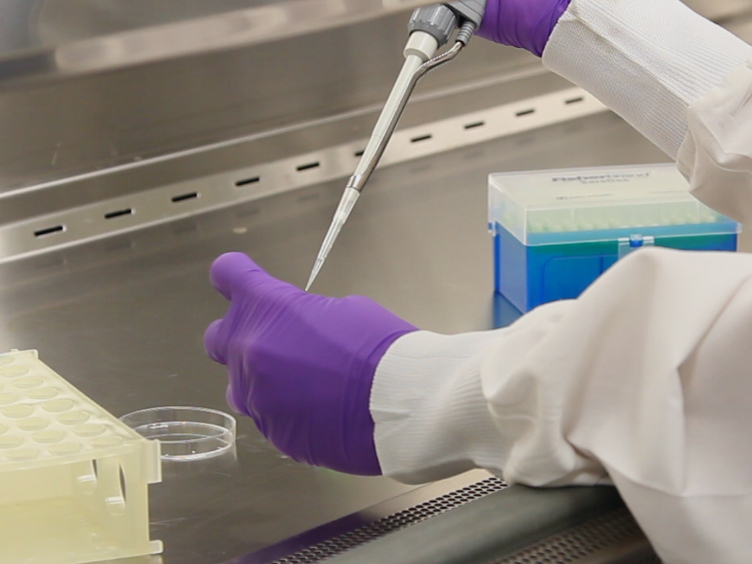
Where is `plastic lid`? This screenshot has height=564, width=752. plastic lid is located at coordinates (183, 448).